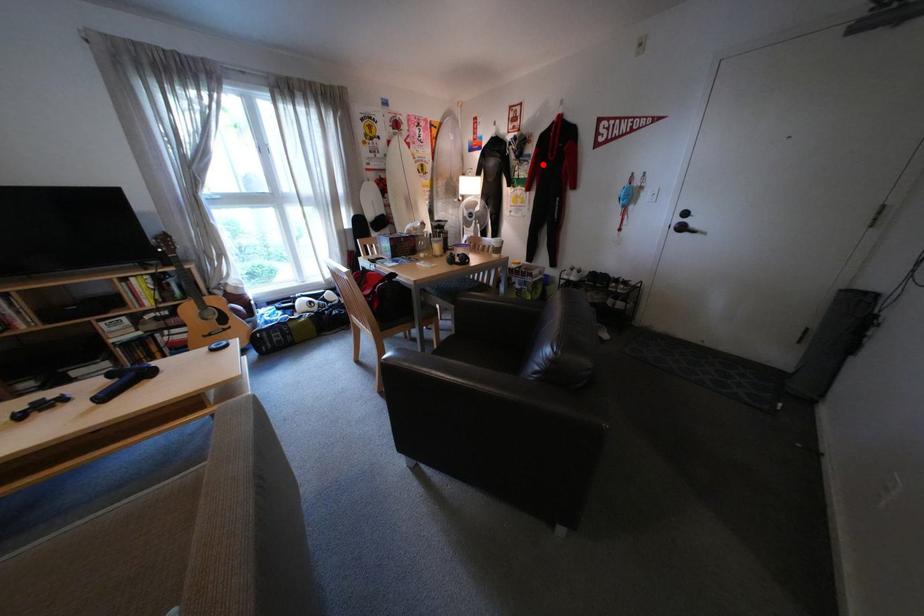
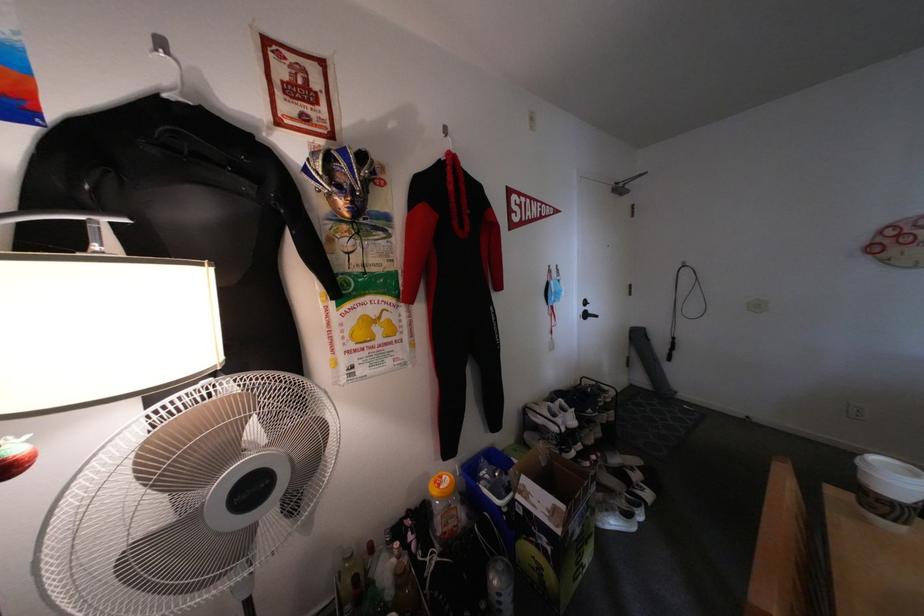
Question: I am providing you with two images of the same scene from different viewpoints. A red point is shown in image1. For the corresponding object point in image2, is it positioned nearer or farther from the camera?

Choices:
 (A) Nearer
 (B) Farther

Answer: (B)